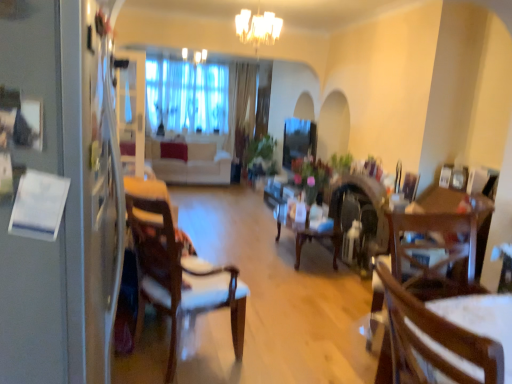
Question: From a real-world perspective, relative to white fabric chair at left, the first chair positioned from the left, is wooden chair at center, which is the 2th chair from right to left, vertically above or below?

Choices:
 (A) below
 (B) above

Answer: (B)

Question: Considering the positions of wooden chair at center, placed as the 2th chair when sorted from left to right, and white fabric chair at left, marked as the third chair in a right-to-left arrangement, in the image, is wooden chair at center, placed as the 2th chair when sorted from left to right, bigger or smaller than white fabric chair at left, marked as the third chair in a right-to-left arrangement,?

Choices:
 (A) big
 (B) small

Answer: (B)

Question: Based on their relative distances, which object is farther from the velvet beige couch at center?

Choices:
 (A) wooden chair at center, which is the 3th chair from back to front
 (B) wooden table at center
 (C) white glass chandelier at upper center
 (D) wooden chair at right, positioned as the third chair in left-to-right order
 (E) white glossy fridge at left

Answer: (A)

Question: Which of these objects is positioned closest to the wooden chair at right, the first chair positioned from the right?

Choices:
 (A) transparent glass window screen at center
 (B) wooden chair at center, which is the 3th chair from back to front
 (C) velvet beige couch at center
 (D) white fabric chair at left, marked as the third chair in a right-to-left arrangement
 (E) white glass chandelier at upper center

Answer: (B)